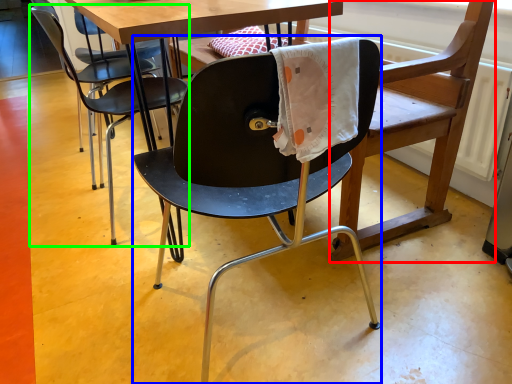
Question: Estimate the real-world distances between objects in this image. Which object is closer to swivel chair (highlighted by a red box), chair (highlighted by a blue box) or chair (highlighted by a green box)?

Choices:
 (A) chair
 (B) chair

Answer: (A)